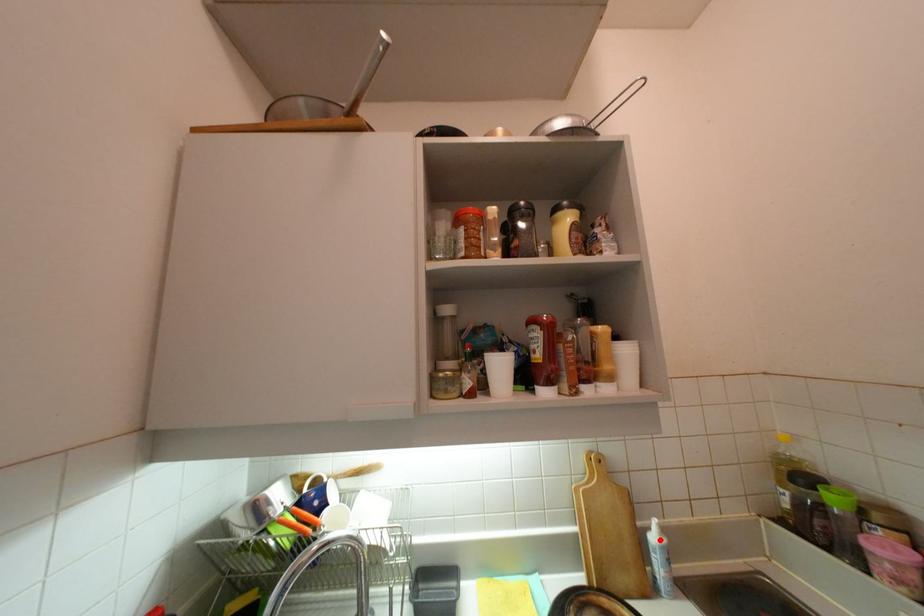
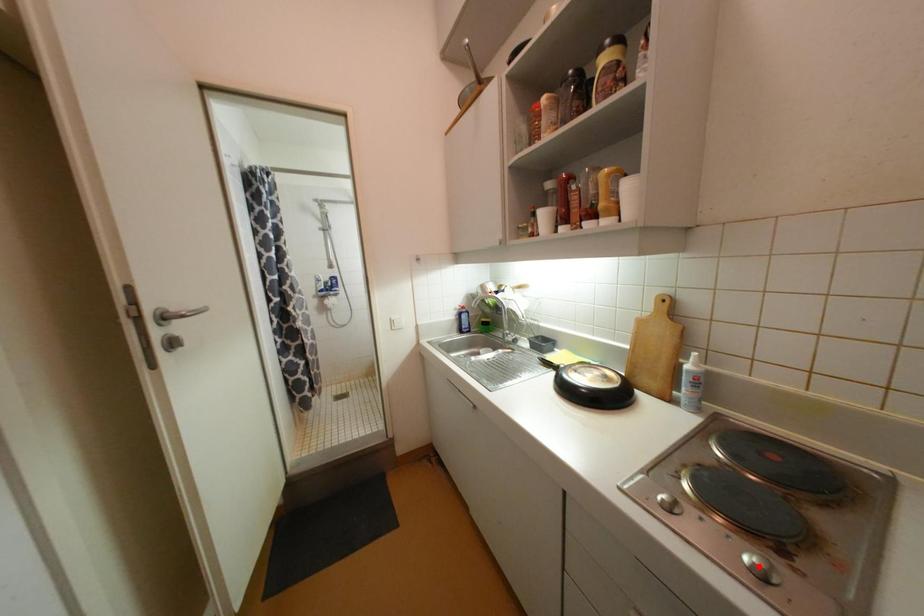
I am providing you with two images of the same scene from different viewpoints. A red point is marked on the first image and another point is marked on the second image. Are the points marked in image1 and image2 representing the same 3D position?

No